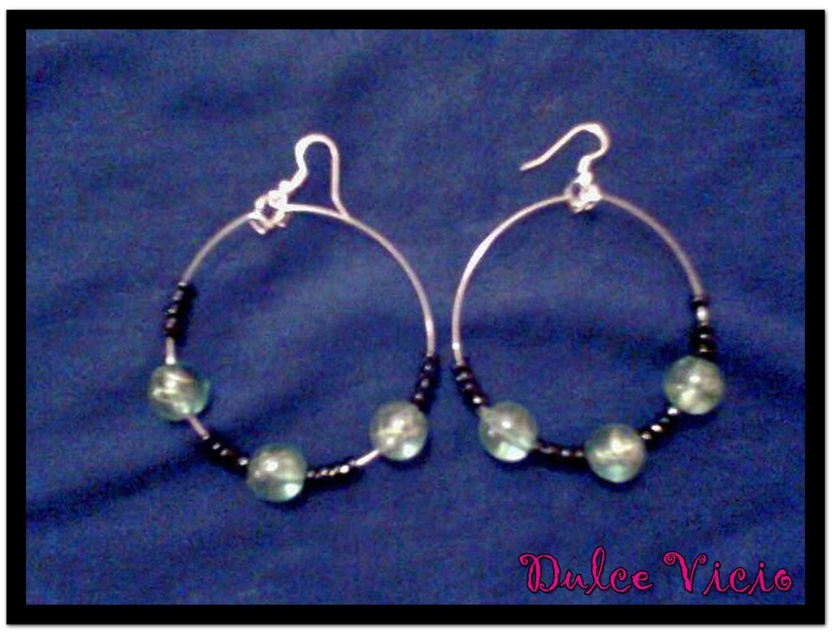
Is translucent glass bead at left above pearl-like glass bead at center?

Correct, translucent glass bead at left is located above pearl-like glass bead at center.

Find the location of a particular element. translucent glass bead at left is located at coordinates (208, 384).

Between translucent glass bead at left and pearl-like glass hoop at center, which one is positioned higher?

pearl-like glass hoop at center

Measure the distance between translucent glass bead at left and pearl-like glass hoop at center.

The distance of translucent glass bead at left from pearl-like glass hoop at center is 10.95 inches.

At what (x,y) coordinates should I click in order to perform the action: click on translucent glass bead at left. Please return your answer as a coordinate pair (x, y). Looking at the image, I should click on (208, 384).

Who is lower down, pearl-like glass hoop at center or translucent glass bead at center?

translucent glass bead at center is below.

Is pearl-like glass hoop at center to the left of translucent glass bead at center from the viewer's perspective?

Incorrect, pearl-like glass hoop at center is not on the left side of translucent glass bead at center.

The height and width of the screenshot is (640, 832). Describe the element at coordinates (667, 248) in the screenshot. I see `pearl-like glass hoop at center` at that location.

Locate an element on the screen. This screenshot has width=832, height=640. pearl-like glass hoop at center is located at coordinates (667, 248).